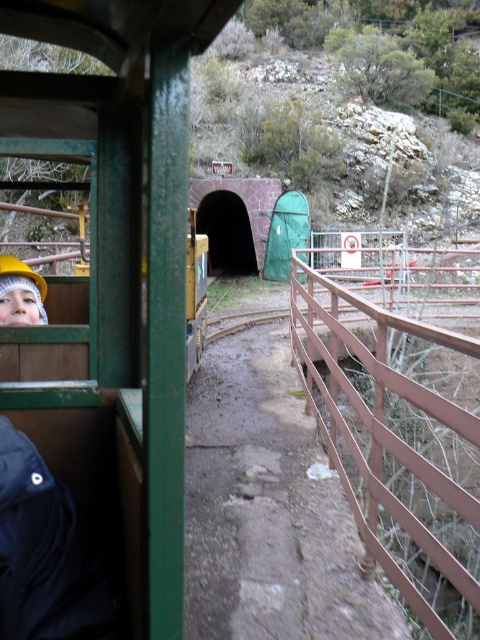
You are standing on the platform next to the metallic green train at left. You want to board the train but need to know if the gap between the platform and the train is safe. The platform is 0.5 meters wide. Can you safely step onto the train?

The metallic green train at left is 1.00 meters from the viewer. Since the platform is only 0.5 meters wide, the gap between the platform and the train is 0.5 meters. This gap may be too wide for safe boarding without assistance. It is recommended to use a step or ask for help to board safely.

Based on the photo, you are a safety inspector checking the train for compliance. You notice the green matte tunnel at center and the hard hat at left. According to safety regulations, the tunnel must be at least twice as wide as any protective gear present. Can the tunnel meet this requirement based on their sizes?

The green matte tunnel at center is wider than the hard hat at left, so it meets the requirement of being at least twice as wide as the hard hat at left.